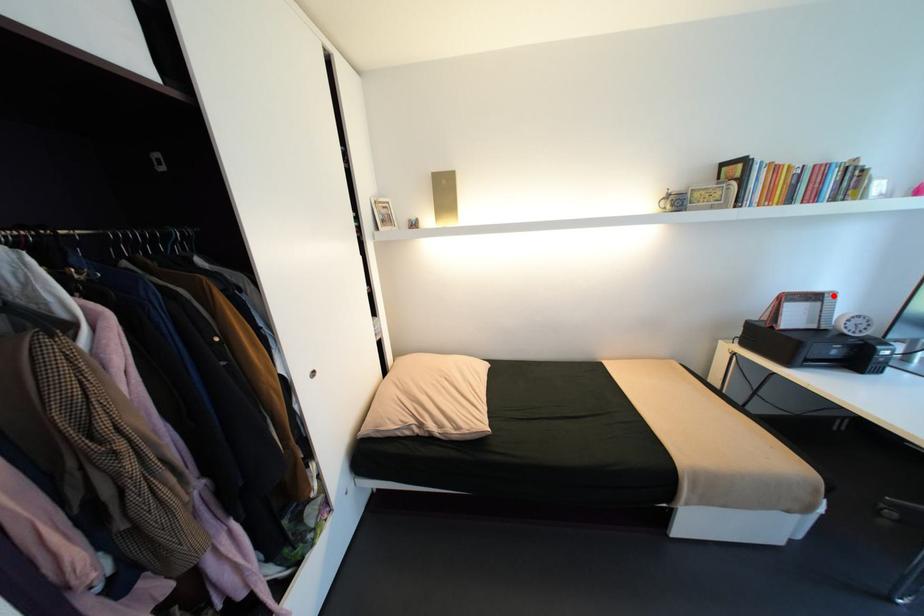
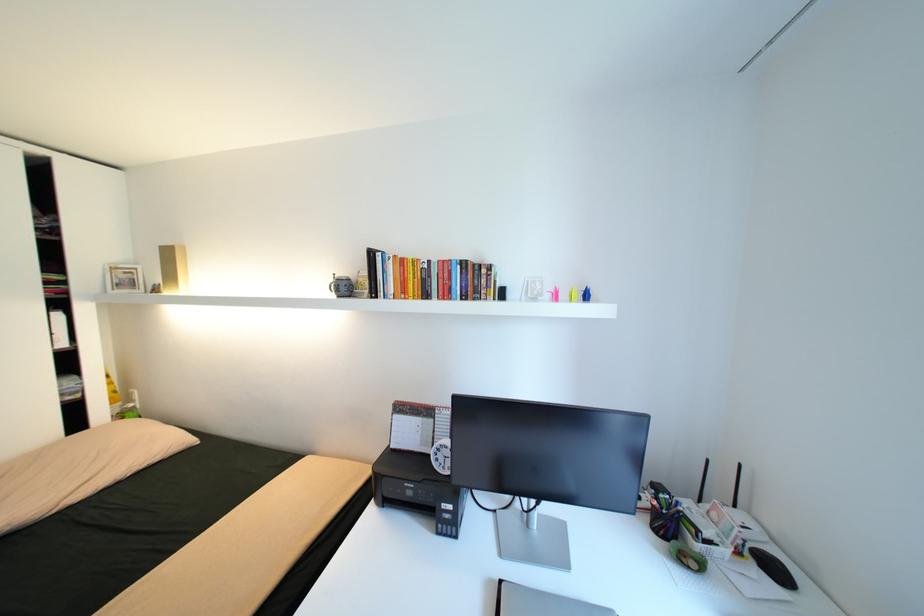
In the second image, find the point that corresponds to the highlighted location in the first image.

(444, 411)